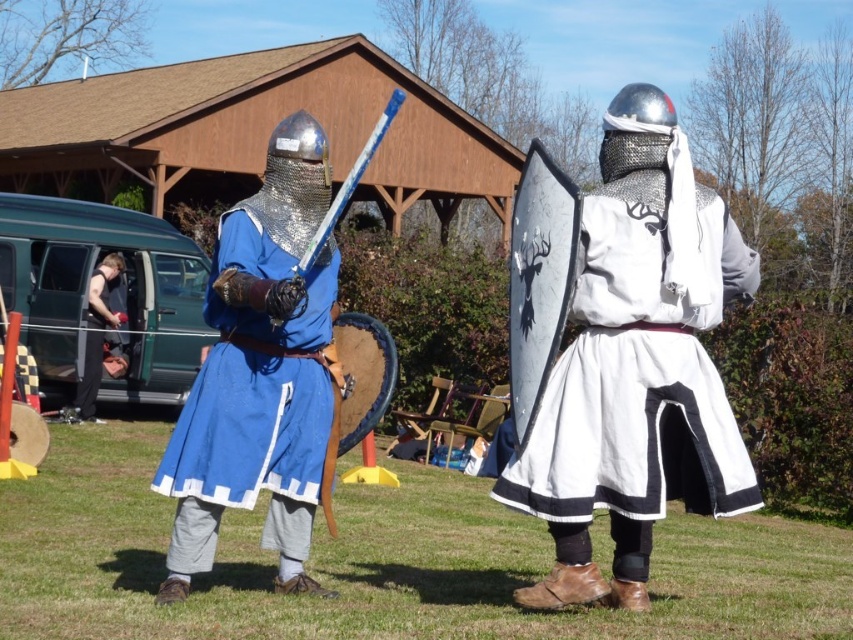
Question: Which of the following is the closest to the observer?

Choices:
 (A) (109, 316)
 (B) (306, 496)

Answer: (B)

Question: Which point is closer to the camera taking this photo?

Choices:
 (A) (270, 490)
 (B) (587, 502)
 (C) (86, 339)

Answer: (B)

Question: Is white cotton tunic at center to the left of matte blue tunic at center from the viewer's perspective?

Choices:
 (A) no
 (B) yes

Answer: (A)

Question: Which of these objects is positioned farthest from the white cotton tunic at center?

Choices:
 (A) matte blue tunic at center
 (B) black leather gloves at left

Answer: (B)

Question: Does white cotton tunic at center appear under matte blue tunic at center?

Choices:
 (A) no
 (B) yes

Answer: (A)

Question: Can you confirm if white cotton tunic at center is positioned below black leather gloves at left?

Choices:
 (A) no
 (B) yes

Answer: (B)